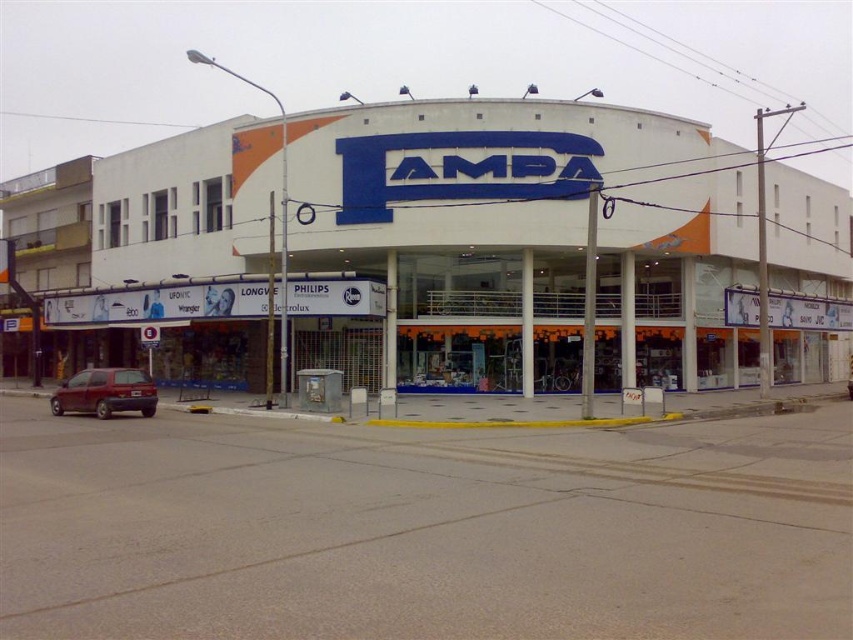
Question: Is white matte building at center positioned behind maroon matte hatchback at lower left?

Choices:
 (A) no
 (B) yes

Answer: (B)

Question: Is white matte building at center bigger than maroon matte hatchback at lower left?

Choices:
 (A) yes
 (B) no

Answer: (A)

Question: Does white matte building at center have a lesser width compared to maroon matte hatchback at lower left?

Choices:
 (A) no
 (B) yes

Answer: (A)

Question: Which object appears closest to the camera in this image?

Choices:
 (A) maroon matte hatchback at lower left
 (B) white matte building at center

Answer: (A)